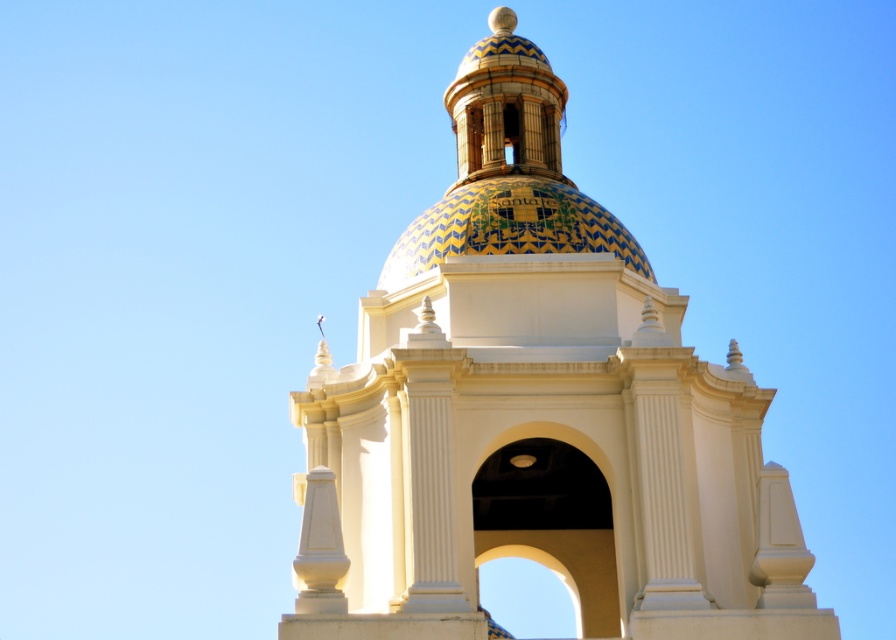
Image resolution: width=896 pixels, height=640 pixels. What do you see at coordinates (535, 416) in the screenshot?
I see `white ceramic dome at center` at bounding box center [535, 416].

What do you see at coordinates (535, 416) in the screenshot?
I see `white ceramic dome at center` at bounding box center [535, 416].

Where is `white ceramic dome at center`? white ceramic dome at center is located at coordinates (535, 416).